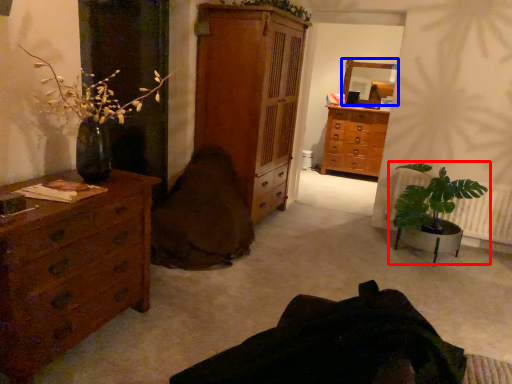
Question: Which of the following is the farthest to the observer, houseplant (highlighted by a red box) or mirror (highlighted by a blue box)?

Choices:
 (A) houseplant
 (B) mirror

Answer: (B)